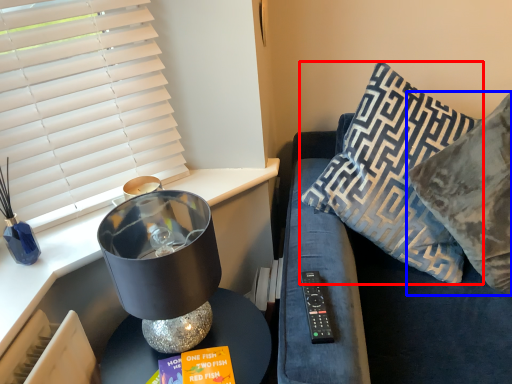
Question: Which point is closer to the camera, pillow (highlighted by a red box) or pillow (highlighted by a blue box)?

Choices:
 (A) pillow
 (B) pillow

Answer: (B)